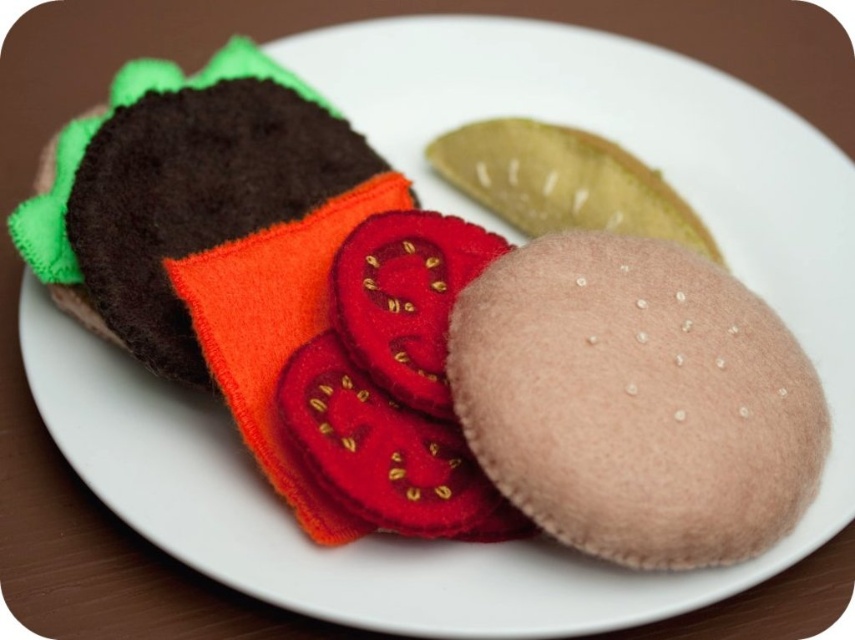
Question: Does beige felt biscuit at center appear on the right side of smooth brown kiwi at center?

Choices:
 (A) no
 (B) yes

Answer: (B)

Question: Is beige felt biscuit at center wider than smooth brown kiwi at center?

Choices:
 (A) yes
 (B) no

Answer: (A)

Question: Which point is closer to the camera?

Choices:
 (A) beige felt biscuit at center
 (B) smooth brown kiwi at center

Answer: (A)

Question: Can you confirm if beige felt biscuit at center is positioned above smooth brown kiwi at center?

Choices:
 (A) yes
 (B) no

Answer: (B)

Question: Which object appears closest to the camera in this image?

Choices:
 (A) beige felt biscuit at center
 (B) smooth brown kiwi at center

Answer: (A)